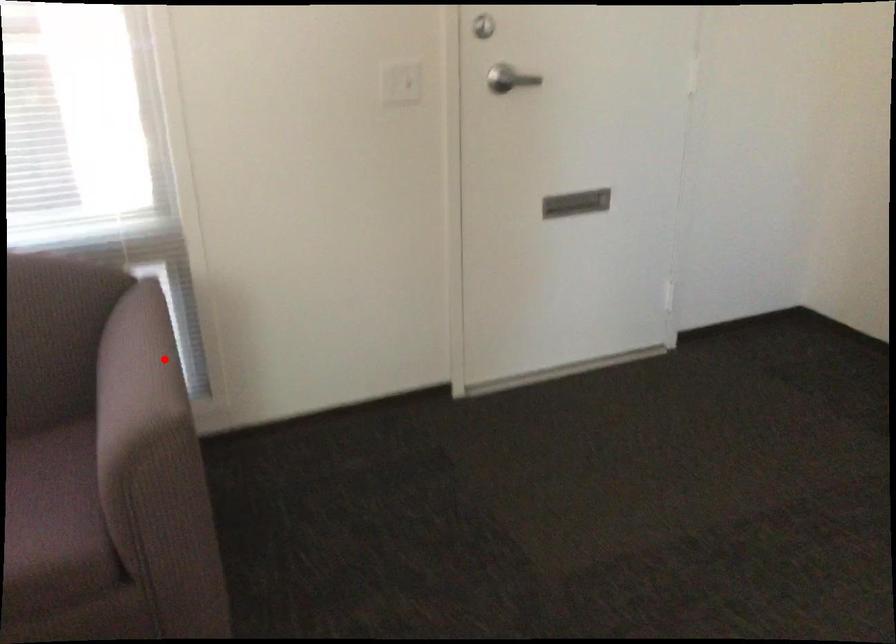
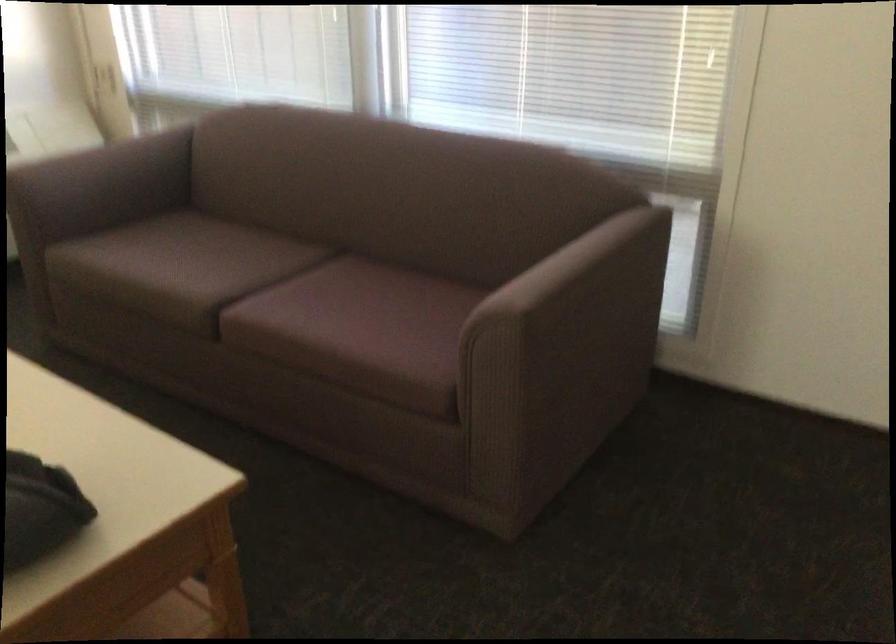
The point at the highlighted location is marked in the first image. Where is the corresponding point in the second image?

(579, 265)